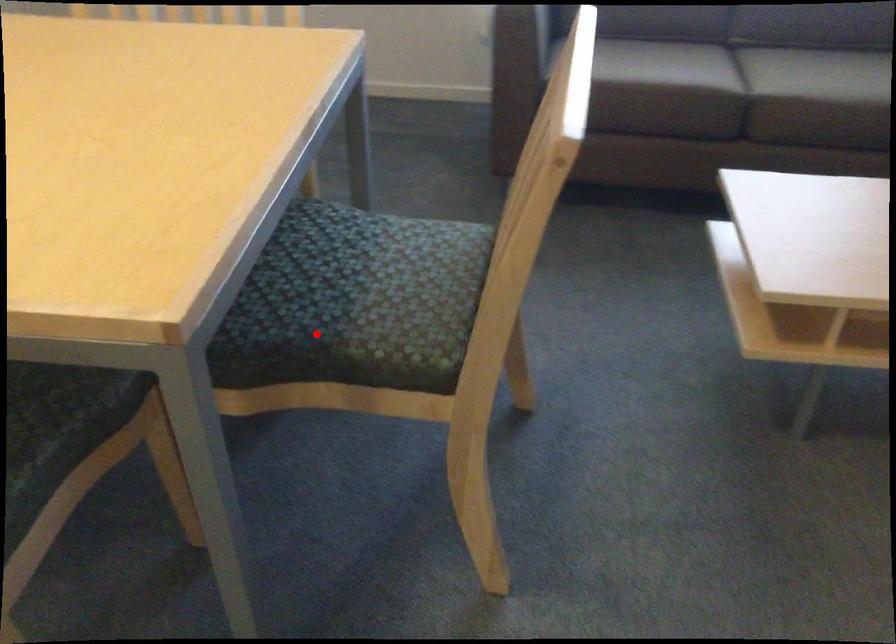
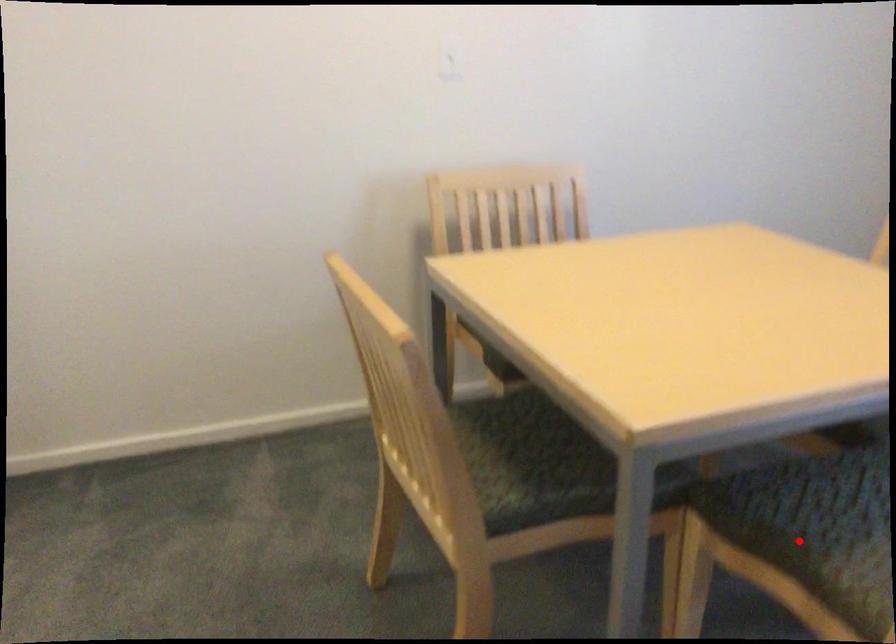
I am providing you with two images of the same scene from different viewpoints. A red point is marked on the first image and another point is marked on the second image. Does the point marked in image1 correspond to the same location as the one in image2?

Yes